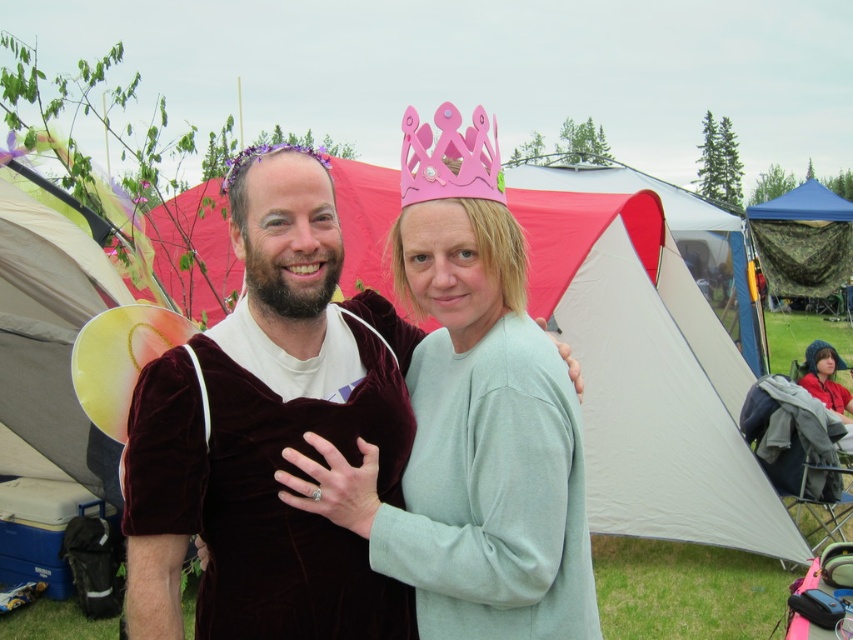
Who is positioned more to the left, camouflage netting at right or pink paper crown at upper center?

pink paper crown at upper center

Is camouflage netting at right wider than pink paper crown at upper center?

Indeed, camouflage netting at right has a greater width compared to pink paper crown at upper center.

This screenshot has height=640, width=853. I want to click on camouflage netting at right, so click(804, 241).

Which is in front, point (403, 428) or point (407, 166)?

Point (407, 166) is more forward.

Is velvet dress at center to the left of pink paper crown at upper center from the viewer's perspective?

Correct, you'll find velvet dress at center to the left of pink paper crown at upper center.

What do you see at coordinates (271, 484) in the screenshot?
I see `velvet dress at center` at bounding box center [271, 484].

The width and height of the screenshot is (853, 640). In order to click on velvet dress at center in this screenshot , I will do `click(271, 484)`.

You are a GUI agent. You are given a task and a screenshot of the screen. Output one action in this format:
    pyautogui.click(x=<x>, y=<y>)
    Task: Click on the velvet maroon cape at center
    This screenshot has width=853, height=640.
    Given the screenshot: What is the action you would take?
    pyautogui.click(x=270, y=432)

Which is behind, point (231, 604) or point (471, 180)?

Positioned behind is point (471, 180).

Locate an element on the screen. Image resolution: width=853 pixels, height=640 pixels. velvet maroon cape at center is located at coordinates (270, 432).